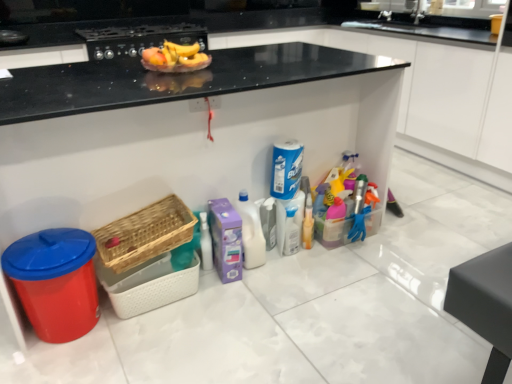
Question: Is woven wood basket at lower left, acting as the second basket starting from the top, looking in the opposite direction of matte black stove at upper center?

Choices:
 (A) yes
 (B) no

Answer: (B)

Question: Is woven wood basket at lower left, acting as the second basket starting from the top, smaller than matte black stove at upper center?

Choices:
 (A) no
 (B) yes

Answer: (B)

Question: Is woven wood basket at lower left, acting as the second basket starting from the top, wider than matte black stove at upper center?

Choices:
 (A) no
 (B) yes

Answer: (A)

Question: Is woven wood basket at lower left, acting as the second basket starting from the top, not near matte black stove at upper center?

Choices:
 (A) yes
 (B) no

Answer: (A)

Question: Can you confirm if woven wood basket at lower left, placed as the first basket when sorted from bottom to top, is shorter than matte black stove at upper center?

Choices:
 (A) no
 (B) yes

Answer: (B)

Question: From a real-world perspective, is shiny plastic bowl at upper center positioned above or below white plastic bottle at center, which appears as the second cleaning product when viewed from the top?

Choices:
 (A) below
 (B) above

Answer: (B)

Question: Considering the positions of shiny plastic bowl at upper center and white plastic bottle at center, the 2th cleaning product when ordered from right to left, in the image, is shiny plastic bowl at upper center wider or thinner than white plastic bottle at center, the 2th cleaning product when ordered from right to left,?

Choices:
 (A) wide
 (B) thin

Answer: (A)

Question: Considering their positions, is shiny plastic bowl at upper center located in front of or behind white plastic bottle at center, the 2th cleaning product when ordered from right to left?

Choices:
 (A) behind
 (B) front

Answer: (B)

Question: Considering the positions of shiny plastic bowl at upper center and white plastic bottle at center, the 1th cleaning product from the left, in the image, is shiny plastic bowl at upper center taller or shorter than white plastic bottle at center, the 1th cleaning product from the left,?

Choices:
 (A) short
 (B) tall

Answer: (A)

Question: In terms of width, does blue glossy spray can at center, marked as the 2th cleaning product in a left-to-right arrangement, look wider or thinner when compared to white plastic bottle at center, which ranks as the first cleaning product in bottom-to-top order?

Choices:
 (A) thin
 (B) wide

Answer: (A)

Question: Is blue glossy spray can at center, acting as the first cleaning product starting from the right, bigger or smaller than white plastic bottle at center, the 1th cleaning product from the left?

Choices:
 (A) small
 (B) big

Answer: (A)

Question: Is blue glossy spray can at center, which appears as the second cleaning product when ordered from the bottom, situated inside white plastic bottle at center, which ranks as the first cleaning product in bottom-to-top order, or outside?

Choices:
 (A) inside
 (B) outside

Answer: (B)

Question: Would you say blue glossy spray can at center, marked as the 2th cleaning product in a left-to-right arrangement, is to the left or to the right of white plastic bottle at center, which appears as the second cleaning product when viewed from the top, in the picture?

Choices:
 (A) right
 (B) left

Answer: (A)

Question: Is matte black stove at upper center spatially inside woven wood basket at lower left, acting as the second basket starting from the top, or outside of it?

Choices:
 (A) inside
 (B) outside

Answer: (B)

Question: Looking at their shapes, would you say matte black stove at upper center is wider or thinner than woven wood basket at lower left, acting as the second basket starting from the top?

Choices:
 (A) thin
 (B) wide

Answer: (B)